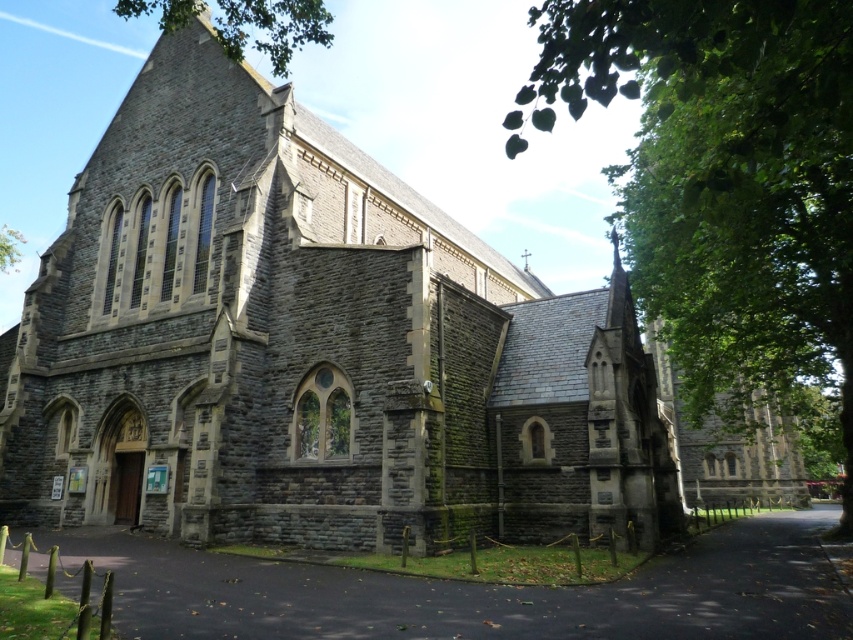
From the picture: You are standing in a park and see the gray stone church at center and the green leafy tree at right. Which object is closer to you? Please explain your reasoning based on their positions.

The gray stone church at center is closer to you because the green leafy tree at right is positioned behind it, indicating that the church is in front.

You are standing at the coordinates 0.5, 0.5 in the image. Can you see the gray stone church at center from your current position?

Yes, the gray stone church at center is located at point (309, 348), so you can see it from your position at (426, 320).